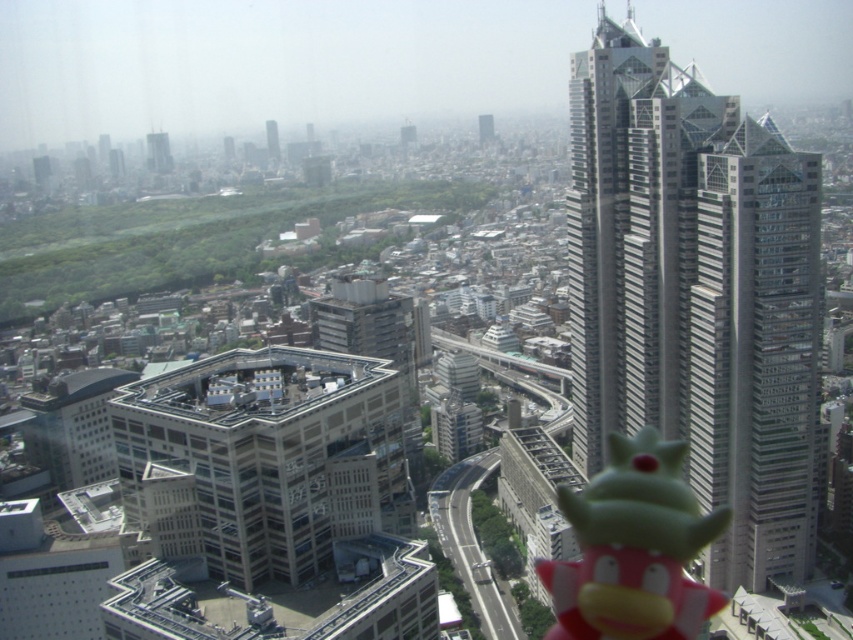
Between point (345, 420) and point (155, 154), which one is positioned behind?

Positioned behind is point (155, 154).

Which of these two, white concrete building at center or gray concrete skyscraper at upper left, stands shorter?

white concrete building at center is shorter.

Does point (305, 396) come closer to viewer compared to point (163, 156)?

Yes, it is.

Find the location of `white concrete building at center`. white concrete building at center is located at coordinates (271, 454).

Which of these two, silver glass skyscraper at upper right or gray concrete skyscraper at upper center, stands taller?

silver glass skyscraper at upper right is taller.

In order to click on silver glass skyscraper at upper right in this screenshot , I will do `click(695, 294)`.

Does green rubber toy at center have a larger size compared to gray concrete skyscraper at upper center?

Yes.

Does green rubber toy at center appear on the right side of gray concrete skyscraper at upper center?

Yes, green rubber toy at center is to the right of gray concrete skyscraper at upper center.

Identify the location of green rubber toy at center. The image size is (853, 640). (633, 548).